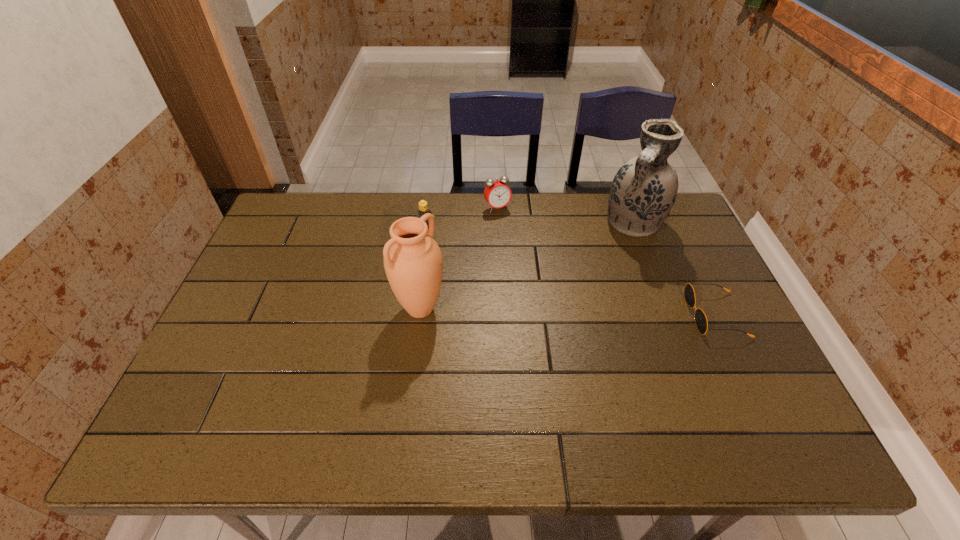
Locate an element on the screen. This screenshot has height=540, width=960. Lego that is at the far edge is located at coordinates (423, 207).

What are the coordinates of `sunglasses present at the right edge` in the screenshot? It's located at (700, 318).

Find the location of a particular element. vase present at the right edge is located at coordinates (643, 191).

At what (x,y) coordinates should I click in order to perform the action: click on object present at the far right corner. Please return your answer as a coordinate pair (x, y). The height and width of the screenshot is (540, 960). Looking at the image, I should click on (643, 191).

I want to click on vacant space at the far edge, so click(x=604, y=202).

Find the location of a particular element. The image size is (960, 540). vacant space at the near edge is located at coordinates (641, 374).

At what (x,y) coordinates should I click in order to perform the action: click on free spot at the left edge of the desktop. Please return your answer as a coordinate pair (x, y). Image resolution: width=960 pixels, height=540 pixels. Looking at the image, I should click on (244, 278).

Find the location of a particular element. The height and width of the screenshot is (540, 960). free point at the right edge is located at coordinates (666, 247).

In the image, there is a desktop. Where is `free space at the far right corner`? This screenshot has width=960, height=540. free space at the far right corner is located at coordinates (672, 210).

Image resolution: width=960 pixels, height=540 pixels. I want to click on free space at the near right corner, so click(x=771, y=398).